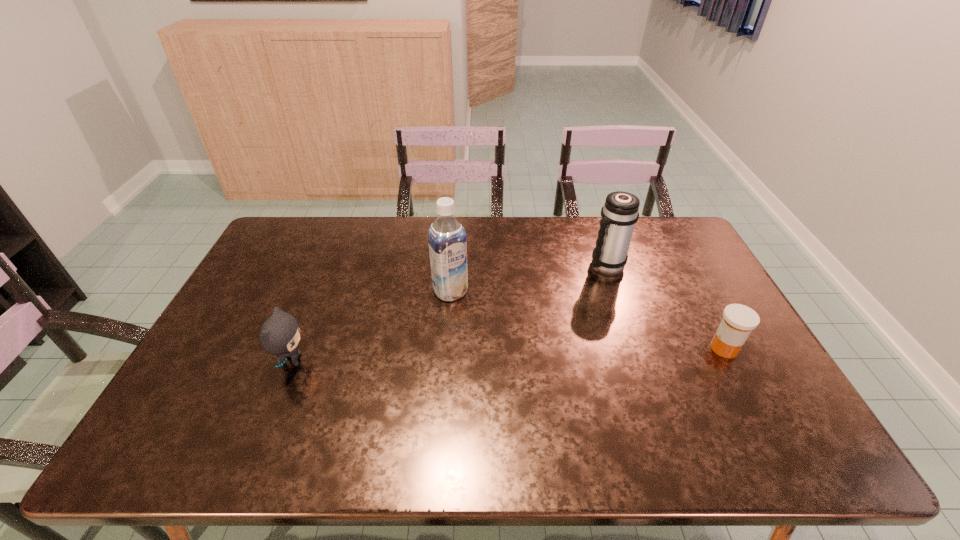
Locate an element on the screen. The width and height of the screenshot is (960, 540). vacant space that's between the soya milk and the rightmost object is located at coordinates (588, 320).

Find the location of `free space between the soya milk and the second object from right to left`. free space between the soya milk and the second object from right to left is located at coordinates (528, 279).

Locate an element on the screen. This screenshot has width=960, height=540. free space between the rightmost object and the leftmost object is located at coordinates (508, 355).

I want to click on free spot between the third object from right to left and the farthest object, so click(528, 279).

Identify which object is the second closest to the medicine. Please provide its 2D coordinates. Your answer should be formatted as a tuple, i.e. [(x, y)], where the tuple contains the x and y coordinates of a point satisfying the conditions above.

[(447, 239)]

Locate an element on the screen. object that ranks as the closest to the third shortest object is located at coordinates (738, 321).